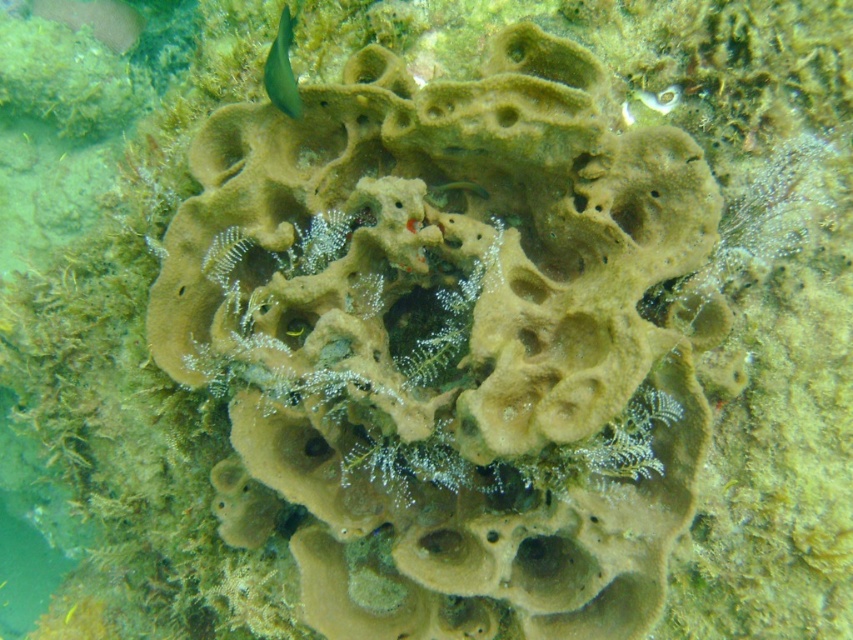
You are an underwater photographer aiming to capture both the green matte fish at upper left and the green matte fish at center in a single frame. Based on their positions, which fish should you position your camera closer to in order to include both in the shot?

You should position your camera closer to the green matte fish at center because the green matte fish at upper left is to the left of it, allowing both to be captured in the frame when centered on the central fish.